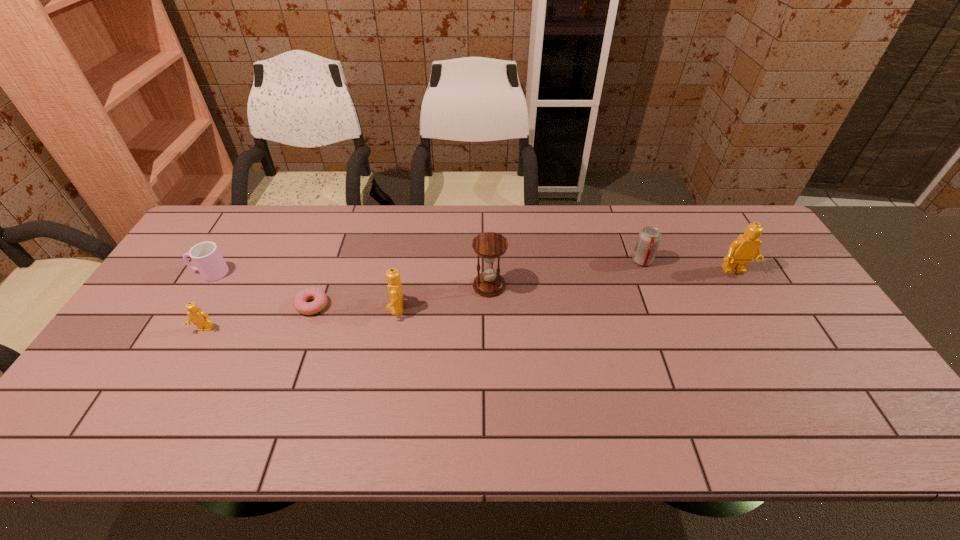
This screenshot has height=540, width=960. Find the location of `the nearest object`. the nearest object is located at coordinates (198, 317).

I want to click on the nearest Lego, so [198, 317].

Where is `the fourth object from left to right`? the fourth object from left to right is located at coordinates pos(395,289).

Where is `the second shortest Lego`? The height and width of the screenshot is (540, 960). the second shortest Lego is located at coordinates (395, 289).

Image resolution: width=960 pixels, height=540 pixels. What are the coordinates of `the rightmost Lego` in the screenshot? It's located at (746, 247).

Identify the location of the rightmost object. (746, 247).

What are the coordinates of `the fifth object from right to left` in the screenshot? It's located at (301, 303).

Image resolution: width=960 pixels, height=540 pixels. In order to click on the shortest object in this screenshot , I will do `click(301, 303)`.

Identify the location of cup. This screenshot has height=540, width=960. (206, 256).

I want to click on the third object from right to left, so click(489, 245).